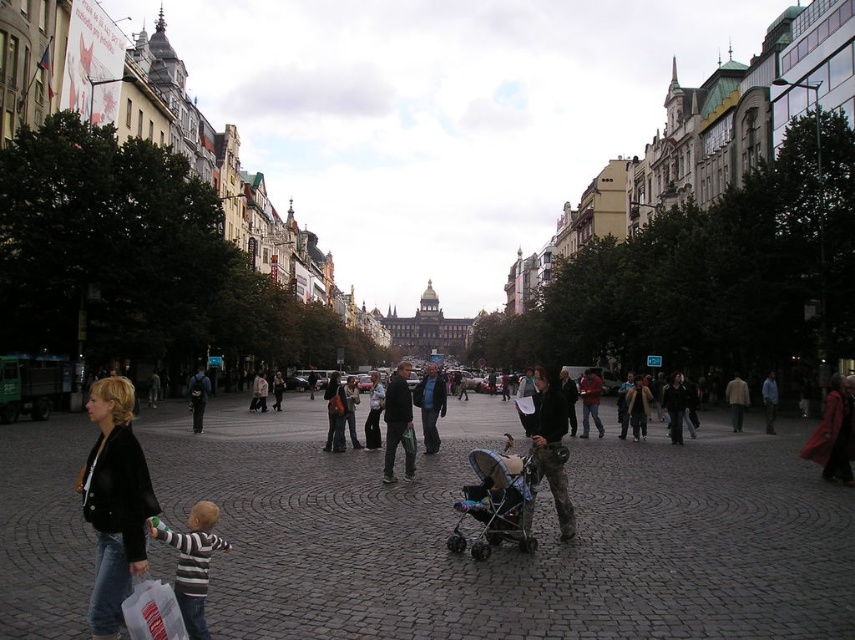
You are a photographer standing in the urban square and want to capture both the black leather jacket at lower left and the matte black stroller at center in a single frame. Which object should you focus on first to ensure both are in the shot?

The black leather jacket at lower left is above the matte black stroller at center, so focusing on the stroller first will allow you to frame the jacket above it within the same shot.

Looking at this image, you are a parent pushing a matte black stroller at center through an urban square. You notice a striped cotton shirt at lower left on the ground. Can you easily reach down to pick up the shirt while holding the stroller?

The matte black stroller at center is above the striped cotton shirt at lower left, meaning the shirt is lower and closer to the ground. Since the stroller is positioned above it, the parent can likely bend down to pick up the shirt as it is within reach while holding the stroller.

Consider the image. You are a photographer standing in the urban square and want to take a photo of the matte black stroller at center without the black leather jacket at lower left appearing in the background. Given their height difference, will the jacket block the view of the stroller?

The black leather jacket at lower left is much taller than the matte black stroller at center, so the jacket will block the view of the stroller in the photo.